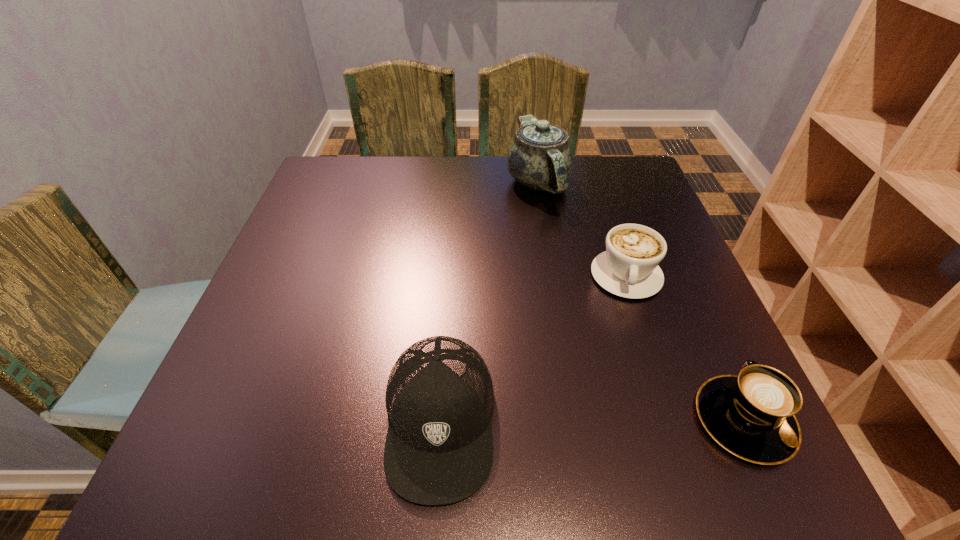
You are a GUI agent. You are given a task and a screenshot of the screen. Output one action in this format:
    pyautogui.click(x=<x>, y=<y>)
    Task: Click on the leftmost object
    This screenshot has width=960, height=540.
    Given the screenshot: What is the action you would take?
    pyautogui.click(x=439, y=398)

The image size is (960, 540). I want to click on cap, so click(x=439, y=398).

Locate an element on the screen. Image resolution: width=960 pixels, height=540 pixels. the nearer cappuccino is located at coordinates (752, 415).

The image size is (960, 540). What are the coordinates of `the farthest object` in the screenshot? It's located at [540, 158].

The image size is (960, 540). Identify the location of the tallest object. (540, 158).

I want to click on the second farthest object, so click(x=629, y=268).

Find the location of `vacant space positioned 0.370m on the back of the nearer cappuccino`. vacant space positioned 0.370m on the back of the nearer cappuccino is located at coordinates (663, 241).

Find the location of a particular element. vacant space located from the spout of the chinaware is located at coordinates (547, 275).

I want to click on free space located 0.170m from the spout of the chinaware, so click(545, 256).

Locate an element on the screen. This screenshot has width=960, height=540. free space located 0.080m from the spout of the chinaware is located at coordinates (543, 231).